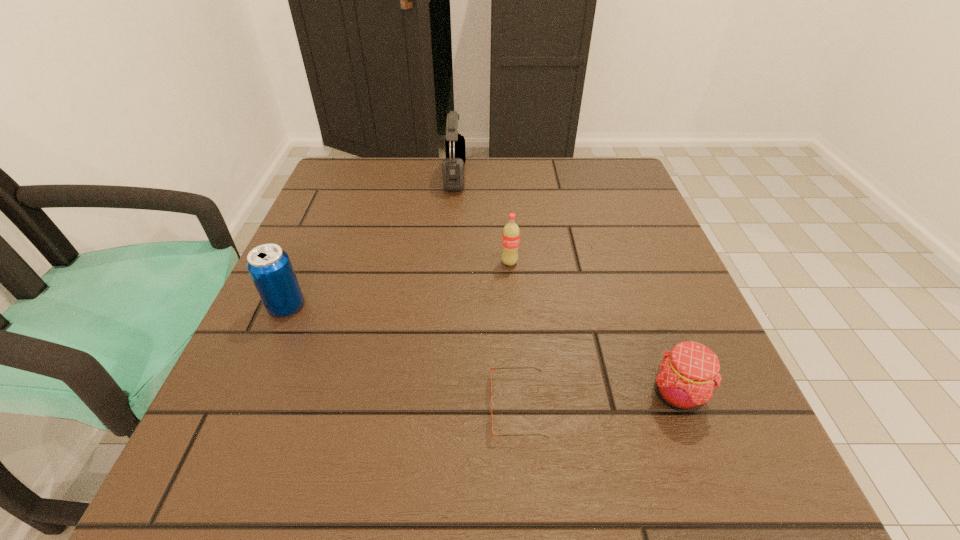
In order to click on vacant space that is in between the farther soda and the left soda in this screenshot , I will do `click(398, 285)`.

Find the location of a particular element. The image size is (960, 540). free space between the rightmost object and the nearer soda is located at coordinates (482, 350).

Image resolution: width=960 pixels, height=540 pixels. I want to click on vacant region between the shortest object and the nearer soda, so click(402, 356).

Where is `free spot between the farther soda and the shortest object`? free spot between the farther soda and the shortest object is located at coordinates (514, 334).

Where is `unoccupied position between the right soda and the shortest object`? The height and width of the screenshot is (540, 960). unoccupied position between the right soda and the shortest object is located at coordinates (514, 334).

Identify which object is located as the second nearest to the fourth tallest object. Please provide its 2D coordinates. Your answer should be formatted as a tuple, i.e. [(x, y)], where the tuple contains the x and y coordinates of a point satisfying the conditions above.

[(511, 232)]

Choose which object is the second nearest neighbor to the shortest object. Please provide its 2D coordinates. Your answer should be formatted as a tuple, i.e. [(x, y)], where the tuple contains the x and y coordinates of a point satisfying the conditions above.

[(511, 232)]

This screenshot has width=960, height=540. Find the location of `blank space that satisfies the following two spatial constraints: 1. on the back side of the rightmost object; 2. on the headband of the farthest object`. blank space that satisfies the following two spatial constraints: 1. on the back side of the rightmost object; 2. on the headband of the farthest object is located at coordinates (596, 176).

Find the location of `blank area in the image that satisfies the following two spatial constraints: 1. on the headband of the rightmost object; 2. on the left side of the farthest object`. blank area in the image that satisfies the following two spatial constraints: 1. on the headband of the rightmost object; 2. on the left side of the farthest object is located at coordinates (438, 394).

Find the location of `vacant region that satisfies the following two spatial constraints: 1. on the back side of the rightmost object; 2. on the headband of the headset`. vacant region that satisfies the following two spatial constraints: 1. on the back side of the rightmost object; 2. on the headband of the headset is located at coordinates (596, 176).